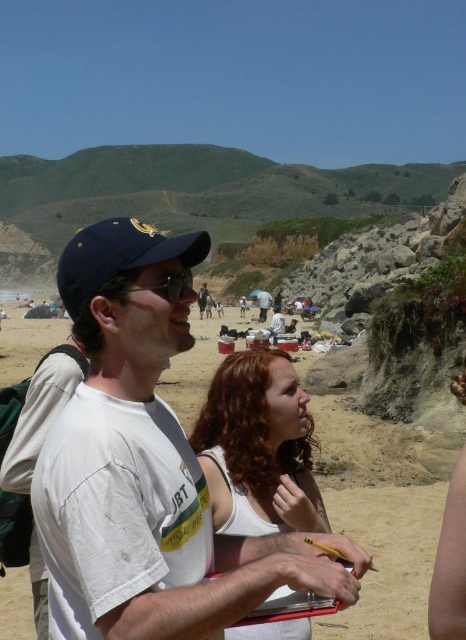
Question: Among these points, which one is nearest to the camera?

Choices:
 (A) (157, 268)
 (B) (102, 276)

Answer: (B)

Question: Is navy blue fabric baseball cap at left to the left of matte black backpack at center from the viewer's perspective?

Choices:
 (A) no
 (B) yes

Answer: (A)

Question: Among these objects, which one is farthest from the camera?

Choices:
 (A) white cotton shirt at center
 (B) white cotton t-shirt at center

Answer: (A)

Question: Estimate the real-world distances between objects in this image. Which object is farther from the white cotton shirt at center?

Choices:
 (A) navy blue fabric baseball cap at left
 (B) matte black backpack at center
 (C) white cotton t-shirt at center
 (D) blonde hair at center

Answer: (C)

Question: Observing the image, what is the correct spatial positioning of white cotton t-shirt at center in reference to navy blue fabric baseball cap at left?

Choices:
 (A) right
 (B) left

Answer: (A)

Question: Is navy blue fabric baseball cap at left further to camera compared to matte black sunglasses at center?

Choices:
 (A) no
 (B) yes

Answer: (A)